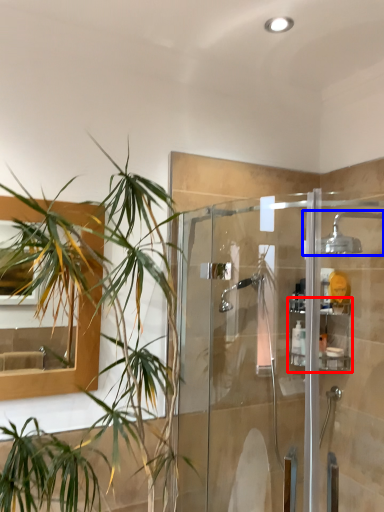
Question: Among these objects, which one is farthest to the camera, shelf (highlighted by a red box) or shower (highlighted by a blue box)?

Choices:
 (A) shelf
 (B) shower

Answer: (A)